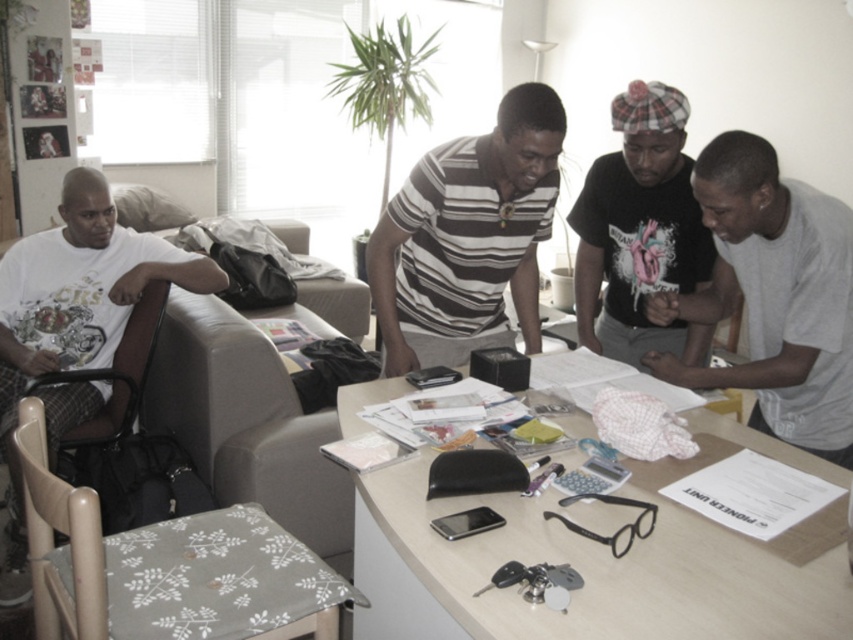
You are standing at the table in the image and want to pick up an item. There are two points marked on the table surface labeled as point (833,284) and point (648,216). Which point is closer to your current position?

Point (833,284) is closer to the camera than point (648,216), so if you are standing at the table, point (833,284) would be closer to your current position.

You are organizing a charity event and need to decide which shirt to wear. You have a gray cotton shirt at center and a black matte shirt at center. According to the image, which one is positioned lower on the table?

The gray cotton shirt at center is positioned lower on the table since it is below the black matte shirt at center.